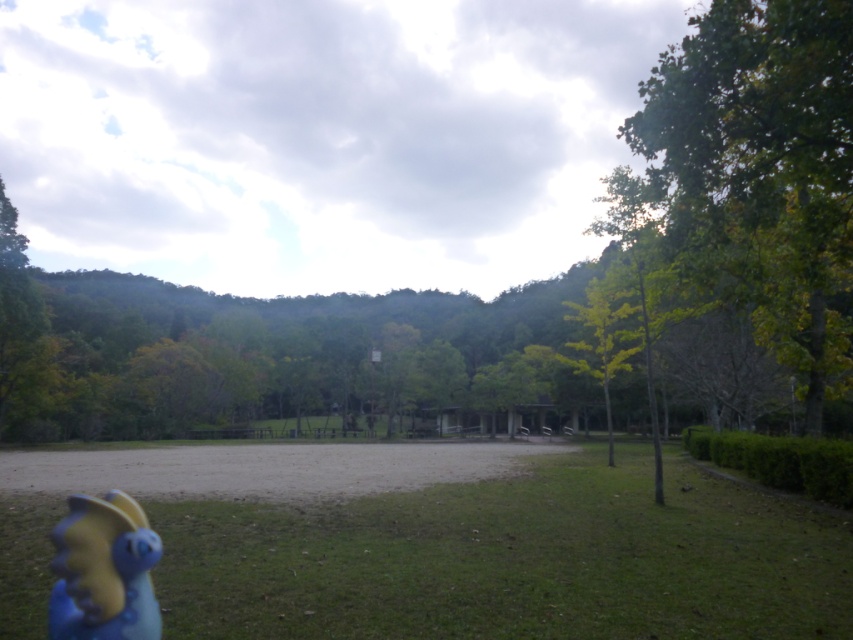
Can you confirm if green grass at center is wider than matte yellow plastic dinosaur at lower left?

Indeed, green grass at center has a greater width compared to matte yellow plastic dinosaur at lower left.

From the picture: Between green grass at center and matte yellow plastic dinosaur at lower left, which one appears on the left side from the viewer's perspective?

Positioned to the left is matte yellow plastic dinosaur at lower left.

Does point (306, 621) lie in front of point (73, 538)?

No, it is not.

Locate an element on the screen. The image size is (853, 640). green grass at center is located at coordinates (511, 561).

In the scene shown: Does green grass at center have a lesser width compared to yellow-green leaves at center-right?

In fact, green grass at center might be wider than yellow-green leaves at center-right.

Does green grass at center have a lesser height compared to yellow-green leaves at center-right?

Correct, green grass at center is not as tall as yellow-green leaves at center-right.

Where is `green grass at center`? The height and width of the screenshot is (640, 853). green grass at center is located at coordinates (511, 561).

Is green grass at center wider than green leafy tree at right?

No.

Between green grass at center and green leafy tree at right, which one appears on the right side from the viewer's perspective?

green leafy tree at right is more to the right.

Who is more distant from viewer, (511,621) or (749,76)?

Point (749,76)

The height and width of the screenshot is (640, 853). In order to click on green grass at center in this screenshot , I will do `click(511, 561)`.